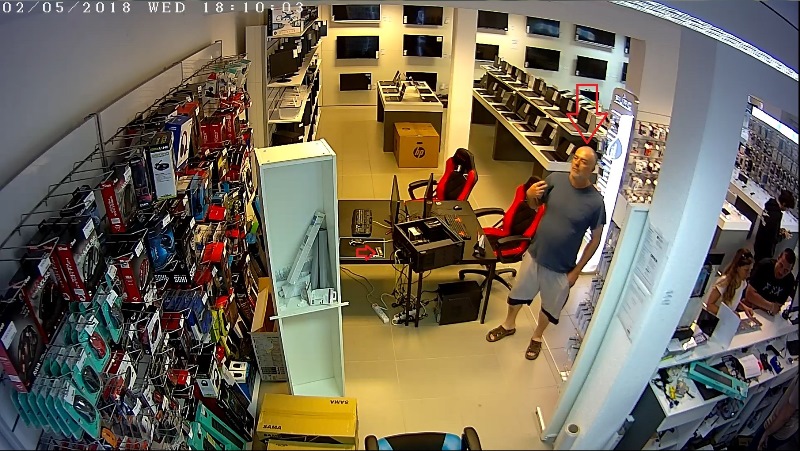
The width and height of the screenshot is (800, 451). In order to click on electrical wires in this screenshot , I will do `click(382, 304)`, `click(394, 299)`.